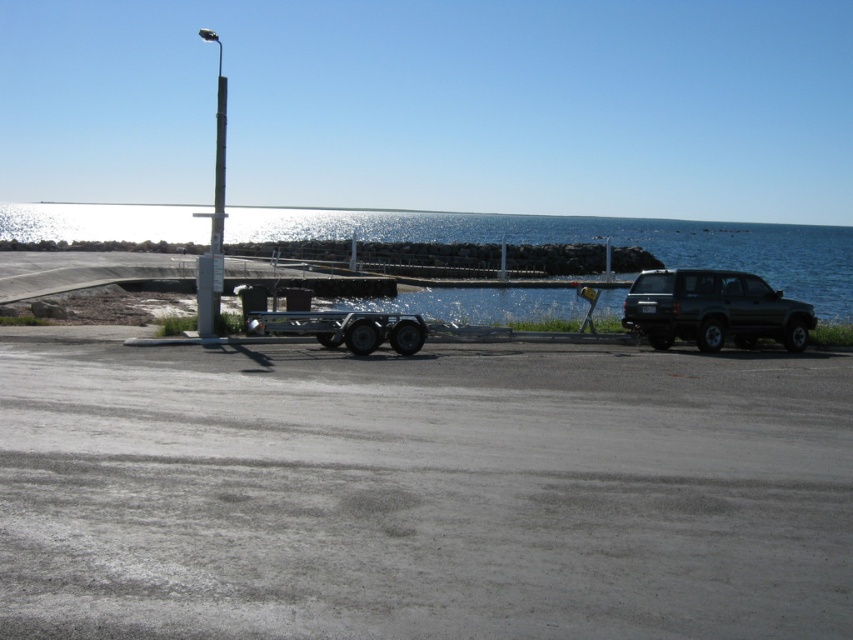
Is gray asphalt parking lot at center smaller than metallic pole at left?

Yes.

Does gray asphalt parking lot at center appear over metallic pole at left?

No.

Find the location of a particular element. gray asphalt parking lot at center is located at coordinates (422, 493).

Find the location of a particular element. The width and height of the screenshot is (853, 640). gray asphalt parking lot at center is located at coordinates (422, 493).

Who is shorter, black matte suv at right or metallic pole at left?

black matte suv at right

Is black matte suv at right positioned behind metallic pole at left?

No, black matte suv at right is closer to the viewer.

Who is more forward, (756, 332) or (223, 154)?

Positioned in front is point (756, 332).

Image resolution: width=853 pixels, height=640 pixels. I want to click on black matte suv at right, so click(x=712, y=308).

Which is behind, point (846, 376) or point (640, 234)?

Point (640, 234)

Identify the location of gray asphalt parking lot at center. (422, 493).

The image size is (853, 640). I want to click on gray asphalt parking lot at center, so click(x=422, y=493).